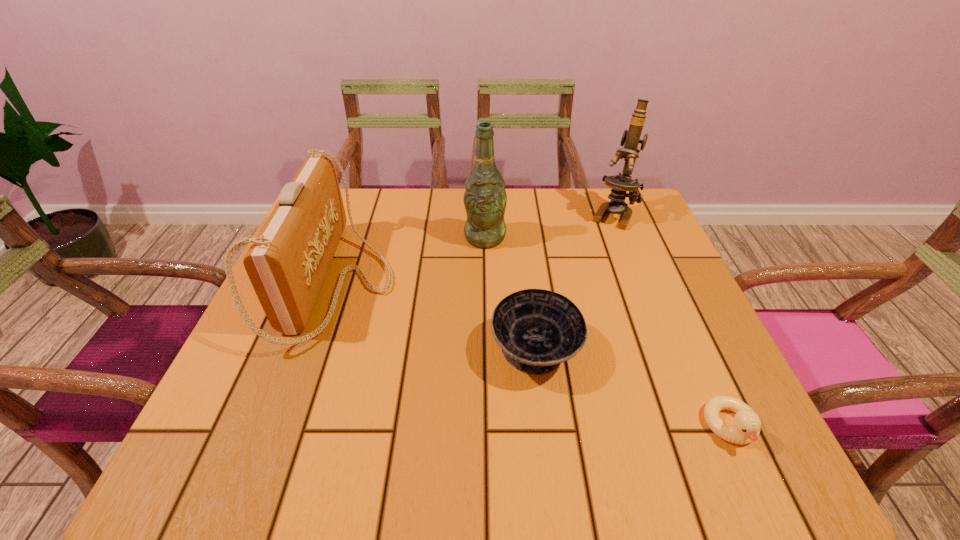
This screenshot has width=960, height=540. Identify the location of microscope. (621, 183).

Locate an element on the screen. The image size is (960, 540). beer bottle is located at coordinates (485, 198).

The image size is (960, 540). What are the coordinates of `the third shortest object` in the screenshot? It's located at (287, 263).

You are a GUI agent. You are given a task and a screenshot of the screen. Output one action in this format:
    pyautogui.click(x=<x>, y=<y>)
    Task: Click on the leftmost object
    
    Given the screenshot: What is the action you would take?
    [287, 263]

Where is `the fourth tallest object`? The height and width of the screenshot is (540, 960). the fourth tallest object is located at coordinates (537, 330).

Identify the location of the nearest object. [746, 428].

The height and width of the screenshot is (540, 960). Identify the location of the shortest object. (746, 428).

In order to click on free space located 0.080m on the left of the microscope in this screenshot , I will do `click(561, 215)`.

Where is `vacant space situated 0.200m on the surface of the beer bottle`? vacant space situated 0.200m on the surface of the beer bottle is located at coordinates (486, 309).

This screenshot has height=540, width=960. In order to click on free space located 0.220m on the decorative side of the third tallest object in this screenshot , I will do `click(491, 282)`.